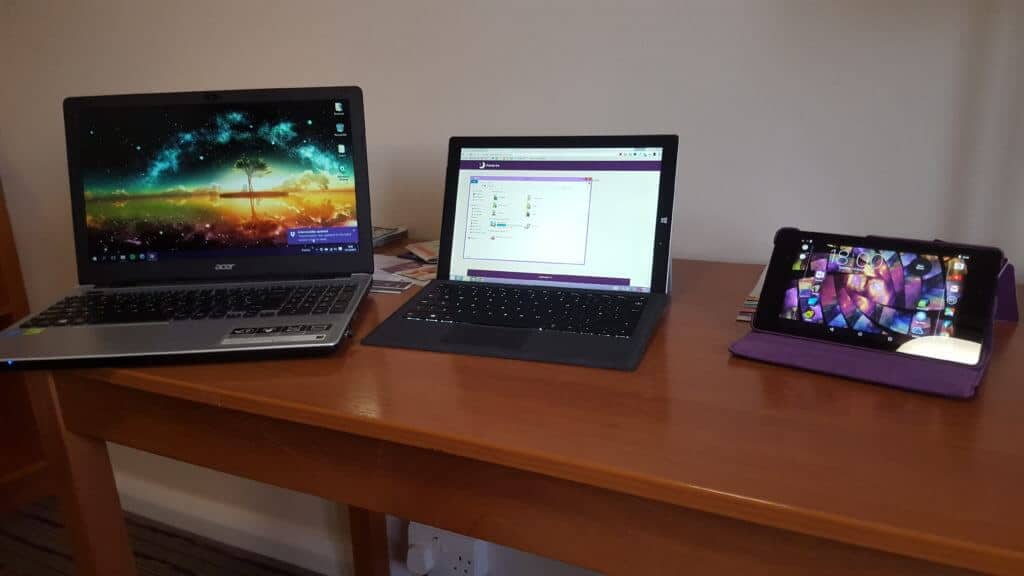
Find the location of a particular element. Image resolution: width=1024 pixels, height=576 pixels. electrical receptable is located at coordinates (459, 569).